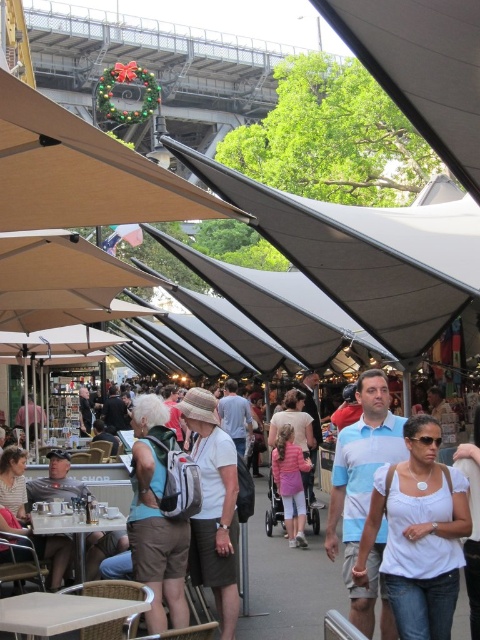
Identify the location of gray fabric canopy at center. (364, 252).

Looking at this image, who is lower down, gray fabric canopy at center or white matte shirt at center?

white matte shirt at center

Is point (275, 228) positioned in front of point (408, 608)?

No, (275, 228) is behind (408, 608).

The image size is (480, 640). In order to click on gray fabric canopy at center in this screenshot , I will do `click(364, 252)`.

Is gray fabric canopy at center thinner than blue striped polo shirt at center?

No.

Does point (471, 236) come farther from viewer compared to point (337, 440)?

Yes.

Image resolution: width=480 pixels, height=640 pixels. I want to click on gray fabric canopy at center, so click(364, 252).

Is white matte shirt at center wider than blue striped polo shirt at center?

Indeed, white matte shirt at center has a greater width compared to blue striped polo shirt at center.

Is white matte shirt at center taller than blue striped polo shirt at center?

Incorrect, white matte shirt at center's height is not larger of blue striped polo shirt at center's.

Does point (456, 588) come farther from viewer compared to point (348, 586)?

No, (456, 588) is in front of (348, 586).

What are the coordinates of `white matte shirt at center` in the screenshot? It's located at (x=419, y=534).